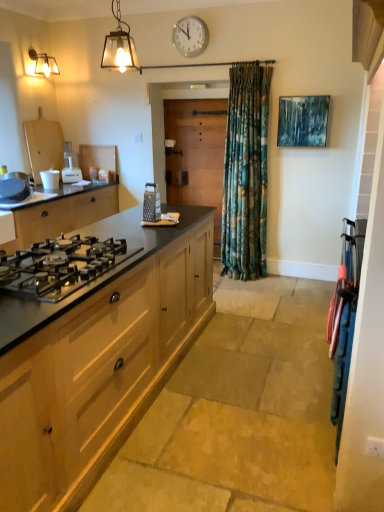
Find the location of a particular element. This screenshot has width=384, height=512. free space to the left of blue metallic suitcase at right, which is the fifth appliance from left to right is located at coordinates (249, 414).